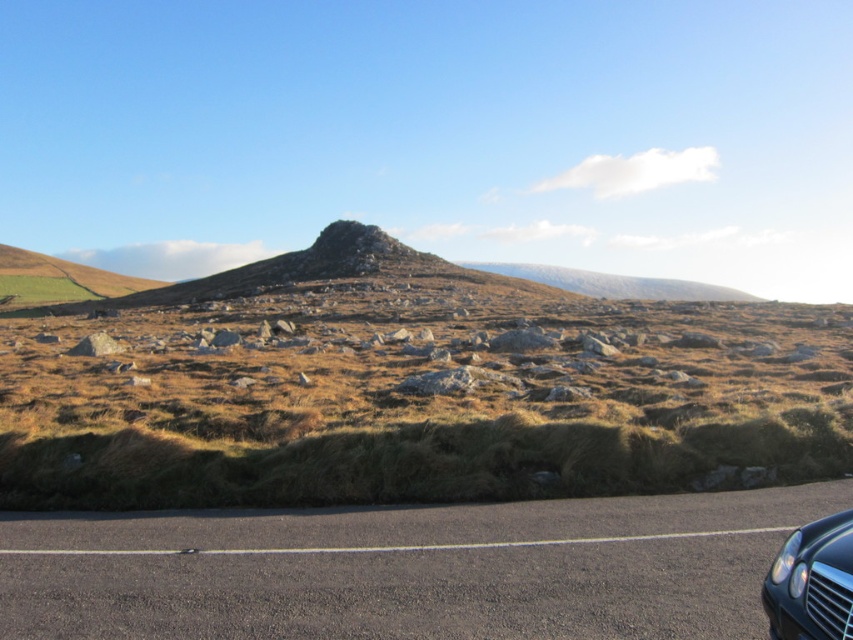
Question: Considering the relative positions of brown grassy hill at center and shiny black car at lower right in the image provided, where is brown grassy hill at center located with respect to shiny black car at lower right?

Choices:
 (A) right
 (B) left

Answer: (B)

Question: Which point is farther to the camera?

Choices:
 (A) brown grassy hill at center
 (B) shiny black car at lower right

Answer: (A)

Question: Does brown grassy hill at center appear on the right side of shiny black car at lower right?

Choices:
 (A) yes
 (B) no

Answer: (B)

Question: Is brown grassy hill at center to the right of shiny black car at lower right from the viewer's perspective?

Choices:
 (A) yes
 (B) no

Answer: (B)